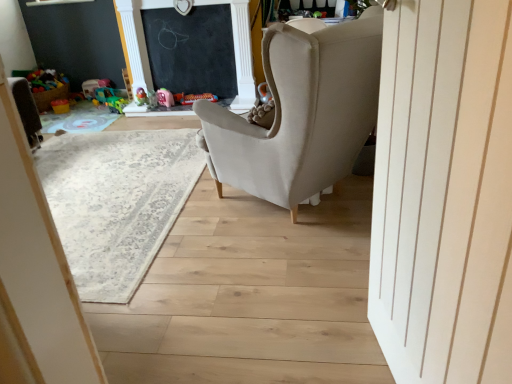
Find the location of a particular element. Image resolution: width=512 pixels, height=384 pixels. free space above rubberized green toy at upper left, which is counted as the 3th toy, starting from the left (from a real-world perspective) is located at coordinates (140, 84).